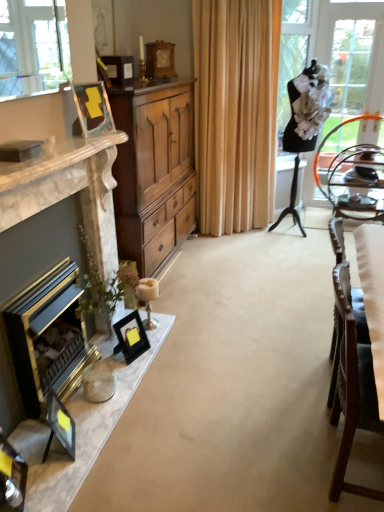
Describe the element at coordinates (373, 296) in the screenshot. I see `white fabric chair at right` at that location.

Locate an element on the screen. matte black picture frame at upper center, the second picture frame viewed from the back is located at coordinates (119, 69).

Describe the element at coordinates (351, 384) in the screenshot. I see `wooden chair at right` at that location.

What is the approximate width of wooden clock at upper center, arranged as the 5th picture frame when viewed from the front?

6.89 inches.

Describe the element at coordinates (48, 338) in the screenshot. The image size is (384, 512). I see `gold metallic fireplace at left, the 2th fireplace in the front-to-back sequence` at that location.

Where is `white fabric chair at right`? white fabric chair at right is located at coordinates (373, 296).

Consider the image. Would you say wooden clock at upper center, which is the 1th picture frame from top to bottom, is outside matte wood picture frame at upper left, the fourth picture frame from the back?

Yes.

Based on the photo, is wooden clock at upper center, arranged as the 5th picture frame when viewed from the front, directly adjacent to matte wood picture frame at upper left, which is counted as the third picture frame, starting from the bottom?

No, wooden clock at upper center, arranged as the 5th picture frame when viewed from the front, is not making contact with matte wood picture frame at upper left, which is counted as the third picture frame, starting from the bottom.

Considering the positions of point (161, 48) and point (97, 99), is point (161, 48) closer or farther from the camera than point (97, 99)?

Point (161, 48) is farther from the camera than point (97, 99).

From a real-world perspective, is wooden clock at upper center, which is the 1th picture frame from top to bottom, over matte wood picture frame at upper left, the fourth picture frame from the back?

Correct, in the physical world, wooden clock at upper center, which is the 1th picture frame from top to bottom, is higher than matte wood picture frame at upper left, the fourth picture frame from the back.

In the scene shown: Is matte black picture frame at lower left, the 5th picture frame viewed from the back, in front of or behind matte wood picture frame at upper left, the 3th picture frame viewed from the top, in the image?

matte black picture frame at lower left, the 5th picture frame viewed from the back, is positioned closer to the viewer than matte wood picture frame at upper left, the 3th picture frame viewed from the top.

Based on their positions, is matte black picture frame at lower left, the first picture frame positioned from the front, located to the left or right of matte wood picture frame at upper left, the 2th picture frame viewed from the front?

Based on their positions, matte black picture frame at lower left, the first picture frame positioned from the front, is located to the left of matte wood picture frame at upper left, the 2th picture frame viewed from the front.

Is matte black picture frame at lower left, the first picture frame positioned from the front, positioned with its back to matte wood picture frame at upper left, the 2th picture frame viewed from the front?

No, matte black picture frame at lower left, the first picture frame positioned from the front,'s orientation is not away from matte wood picture frame at upper left, the 2th picture frame viewed from the front.

Does wooden chair at right have a greater width compared to white fabric chair at right?

Incorrect, the width of wooden chair at right does not surpass that of white fabric chair at right.

Based on the photo, which is more to the left, wooden chair at right or white fabric chair at right?

wooden chair at right is more to the left.

This screenshot has height=512, width=384. Find the location of `chair directly beneath the white fabric chair at right (from a real-world perspective)`. chair directly beneath the white fabric chair at right (from a real-world perspective) is located at coordinates (351, 384).

From the image's perspective, is matte black picture frame at lower left, placed as the third picture frame when sorted from front to back, above or below matte black picture frame at upper center, the second picture frame viewed from the back?

matte black picture frame at lower left, placed as the third picture frame when sorted from front to back, is below matte black picture frame at upper center, the second picture frame viewed from the back.

Is matte black picture frame at lower left, the 3th picture frame from the back, wider than matte black picture frame at upper center, marked as the 4th picture frame in a bottom-to-top arrangement?

In fact, matte black picture frame at lower left, the 3th picture frame from the back, might be narrower than matte black picture frame at upper center, marked as the 4th picture frame in a bottom-to-top arrangement.

Considering the sizes of objects matte black picture frame at lower left, the 3th picture frame from the back, and matte black picture frame at upper center, the second picture frame viewed from the back, in the image provided, who is smaller, matte black picture frame at lower left, the 3th picture frame from the back, or matte black picture frame at upper center, the second picture frame viewed from the back,?

matte black picture frame at lower left, the 3th picture frame from the back.

Is matte black picture frame at upper center, acting as the 4th picture frame starting from the front, spatially inside wooden chair at right, or outside of it?

matte black picture frame at upper center, acting as the 4th picture frame starting from the front, is located beyond the bounds of wooden chair at right.

Looking at this image, from the image's perspective, would you say matte black picture frame at upper center, acting as the 4th picture frame starting from the front, is shown under wooden chair at right?

No.

Considering the positions of objects matte black picture frame at upper center, acting as the 4th picture frame starting from the front, and wooden chair at right in the image provided, who is more to the right, matte black picture frame at upper center, acting as the 4th picture frame starting from the front, or wooden chair at right?

From the viewer's perspective, wooden chair at right appears more on the right side.

Considering the relative sizes of matte black picture frame at upper center, acting as the 4th picture frame starting from the front, and wooden chair at right in the image provided, is matte black picture frame at upper center, acting as the 4th picture frame starting from the front, shorter than wooden chair at right?

Yes, matte black picture frame at upper center, acting as the 4th picture frame starting from the front, is shorter than wooden chair at right.

Is gold metallic fireplace at left, arranged as the first fireplace when viewed from the back, bigger or smaller than matte wood picture frame at upper left, the 3th picture frame viewed from the top?

Clearly, gold metallic fireplace at left, arranged as the first fireplace when viewed from the back, is larger in size than matte wood picture frame at upper left, the 3th picture frame viewed from the top.

Considering the sizes of gold metallic fireplace at left, the 2th fireplace in the front-to-back sequence, and matte wood picture frame at upper left, the 2th picture frame viewed from the front, in the image, is gold metallic fireplace at left, the 2th fireplace in the front-to-back sequence, taller or shorter than matte wood picture frame at upper left, the 2th picture frame viewed from the front,?

Clearly, gold metallic fireplace at left, the 2th fireplace in the front-to-back sequence, is taller compared to matte wood picture frame at upper left, the 2th picture frame viewed from the front.

Can you tell me how much gold metallic fireplace at left, arranged as the first fireplace when viewed from the back, and matte wood picture frame at upper left, the fourth picture frame from the back, differ in facing direction?

The angle between the facing direction of gold metallic fireplace at left, arranged as the first fireplace when viewed from the back, and the facing direction of matte wood picture frame at upper left, the fourth picture frame from the back, is 18.7 degrees.

From the image's perspective, is gold metallic fireplace at left, arranged as the first fireplace when viewed from the back, positioned above or below matte wood picture frame at upper left, the 3th picture frame viewed from the top?

Based on their image positions, gold metallic fireplace at left, arranged as the first fireplace when viewed from the back, is located beneath matte wood picture frame at upper left, the 3th picture frame viewed from the top.

Which is nearer, (364, 347) or (184, 173)?

Positioned in front is point (364, 347).

At what (x,y) coordinates should I click in order to perform the action: click on cabinetry above the wooden chair at right (from a real-world perspective). Please return your answer as a coordinate pair (x, y). Looking at the image, I should click on (153, 170).

From a real-world perspective, is wooden chair at right below wooden cabinet at center?

Yes, from a real-world perspective, wooden chair at right is below wooden cabinet at center.

Is wooden cabinet at center surrounded by wooden chair at right?

No, wooden cabinet at center is not a part of wooden chair at right.

There is a wooden clock at upper center, arranged as the 5th picture frame when viewed from the front. What are the coordinates of `the 2nd picture frame below it (from the image's perspective)` in the screenshot? It's located at (x=91, y=109).

At what (x,y) coordinates should I click in order to perform the action: click on the 1st picture frame located beneath the matte wood picture frame at upper left, which is counted as the third picture frame, starting from the bottom (from a real-world perspective). Please return your answer as a coordinate pair (x, y). The width and height of the screenshot is (384, 512). Looking at the image, I should click on (59, 425).

From the image, which object appears to be farther from white fabric chair at right, wooden clock at upper center, acting as the fifth picture frame starting from the bottom, or wooden chair at right?

The object further to white fabric chair at right is wooden clock at upper center, acting as the fifth picture frame starting from the bottom.

Considering their positions, is metallic silver tray at right positioned further to clear glass door at right than wooden chair at right?

wooden chair at right.

Looking at the image, which one is located closer to white fabric chair at right, matte wood picture frame at upper left, the fourth picture frame from the back, or wooden cabinet at center?

matte wood picture frame at upper left, the fourth picture frame from the back, is closer to white fabric chair at right.

When comparing their distances from clear glass door at right, does matte black picture frame at lower left, the 4th picture frame when ordered from top to bottom, or wooden chair at right seem closer?

matte black picture frame at lower left, the 4th picture frame when ordered from top to bottom, is closer to clear glass door at right.

Looking at the image, which one is located closer to matte black picture frame at lower left, the 5th picture frame when ordered from top to bottom, gold metallic fireplace at left, arranged as the first fireplace when viewed from the back, or metallic silver tray at right?

Based on the image, gold metallic fireplace at left, arranged as the first fireplace when viewed from the back, appears to be nearer to matte black picture frame at lower left, the 5th picture frame when ordered from top to bottom.

Looking at this image, which object lies nearer to the anchor point gold metallic fireplace at left, the 2th fireplace in the front-to-back sequence, wooden clock at upper center, positioned as the first picture frame in back-to-front order, or matte black picture frame at lower left, the 5th picture frame viewed from the back?

The object closer to gold metallic fireplace at left, the 2th fireplace in the front-to-back sequence, is matte black picture frame at lower left, the 5th picture frame viewed from the back.

Based on their spatial positions, is beige fabric curtain at center or matte wood picture frame at upper left, the fourth picture frame from the back, closer to wooden clock at upper center, acting as the fifth picture frame starting from the bottom?

The object closer to wooden clock at upper center, acting as the fifth picture frame starting from the bottom, is beige fabric curtain at center.

When comparing their distances from matte black picture frame at lower left, placed as the third picture frame when sorted from front to back, does beige fabric curtain at center or clear glass door at right seem further?

Among the two, clear glass door at right is located further to matte black picture frame at lower left, placed as the third picture frame when sorted from front to back.

Where is `curtain between clear glass door at right and matte black picture frame at lower left, the 5th picture frame when ordered from top to bottom, from top to bottom`? The image size is (384, 512). curtain between clear glass door at right and matte black picture frame at lower left, the 5th picture frame when ordered from top to bottom, from top to bottom is located at coordinates (235, 112).

The width and height of the screenshot is (384, 512). I want to click on curtain located between gold metallic fireplace at left, arranged as the first fireplace when viewed from the back, and metallic silver tray at right in the left-right direction, so click(x=235, y=112).

Identify the location of picture frame between wooden cabinet at center and matte black picture frame at lower left, the 5th picture frame when ordered from top to bottom, in the vertical direction. The width and height of the screenshot is (384, 512). (131, 337).

Find the location of a particular element. This screenshot has height=512, width=384. chair between gold metallic fireplace at left, arranged as the first fireplace when viewed from the back, and white fabric chair at right is located at coordinates (351, 384).